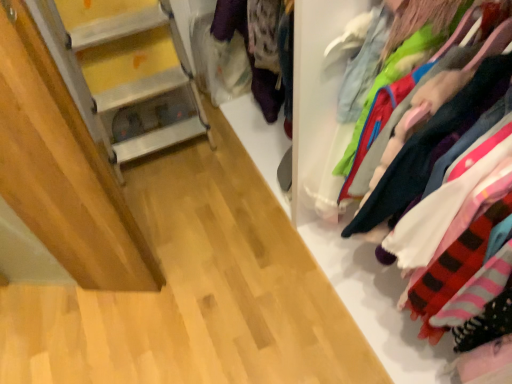
You are a GUI agent. You are given a task and a screenshot of the screen. Output one action in this format:
    pyautogui.click(x=<x>, y=<y>)
    Task: Click on the multicolored fabric clothes at right
    Image resolution: width=512 pixels, height=384 pixels.
    Given the screenshot: What is the action you would take?
    pyautogui.click(x=347, y=207)

What do you see at coordinates (347, 207) in the screenshot?
I see `multicolored fabric clothes at right` at bounding box center [347, 207].

This screenshot has width=512, height=384. Identify the location of multicolored fabric clothes at right. (347, 207).